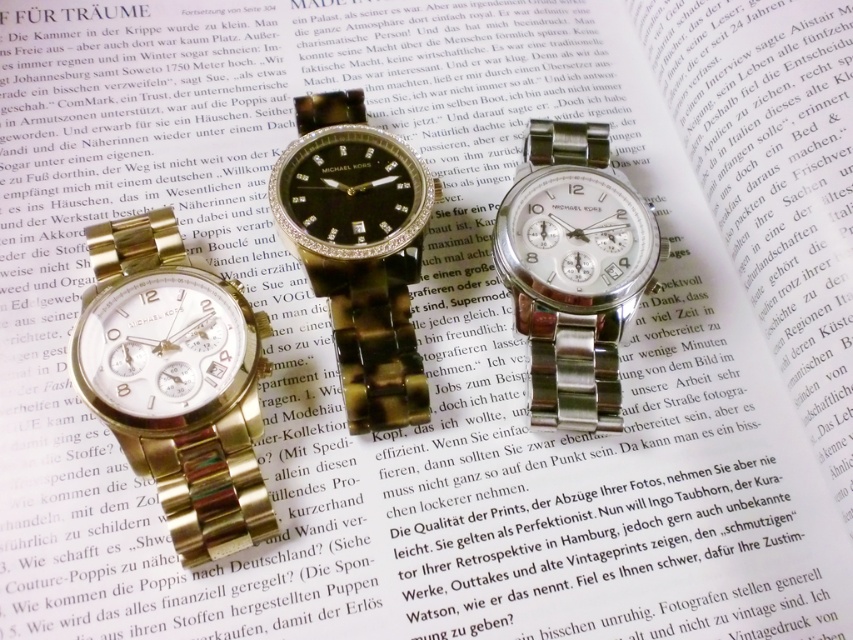
You are looking at three wristwatches arranged on an open book. You need to locate the gold metallic watch at left. Where exactly is it positioned on the book?

The gold metallic watch at left is positioned at point coordinates of 0.597 on the x axis and 0.208 on the y axis.

You are trying to decide which watch to pick up first from the book. Since both the black crystal watch at center and the satin silver watch at center are in the middle, which one is on top?

The black crystal watch at center is positioned over the satin silver watch at center, so it is on top.